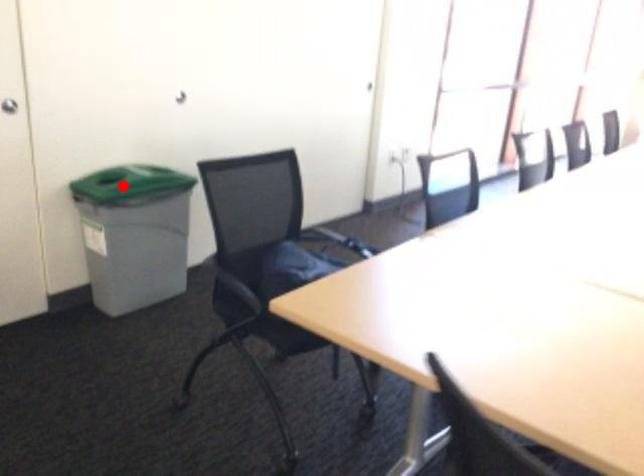
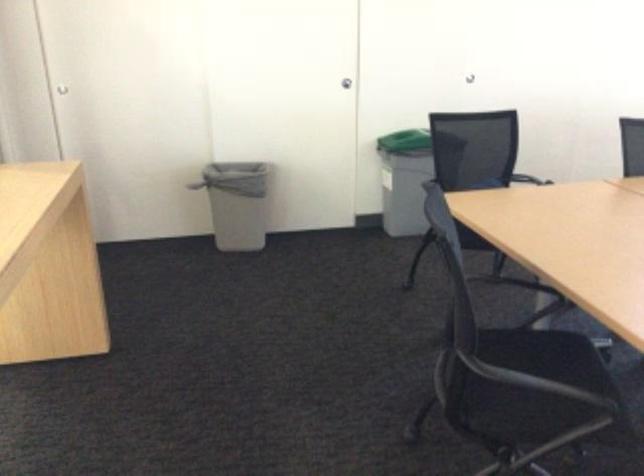
Question: A red point is marked in image1. In image2, is the corresponding 3D point closer to the camera or farther? Reply with the corresponding letter.

Choices:
 (A) The corresponding 3D point is closer.
 (B) The corresponding 3D point is farther.

Answer: (B)